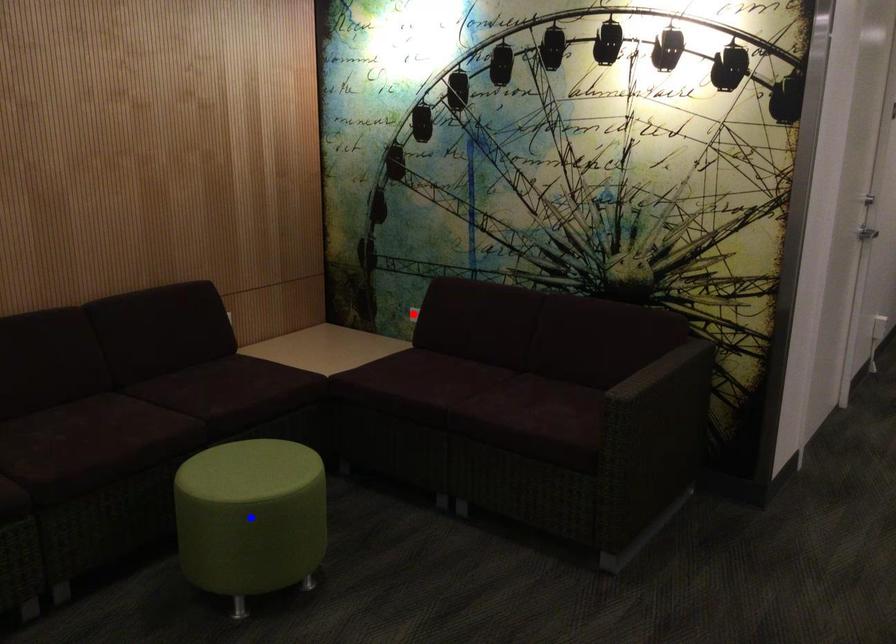
Question: Which of the two points in the image is closer to the camera?

Choices:
 (A) Blue point is closer.
 (B) Red point is closer.

Answer: (A)